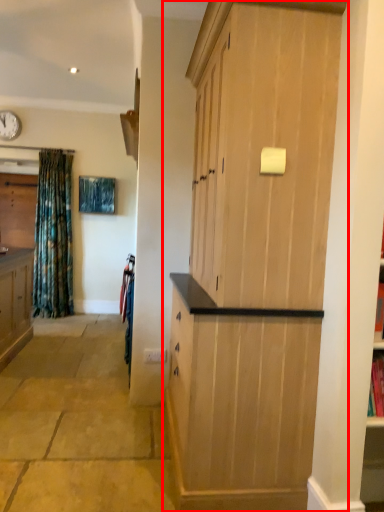
Question: From the image's perspective, what is the correct spatial relationship of cupboard (annotated by the red box) in relation to clock?

Choices:
 (A) below
 (B) above

Answer: (A)